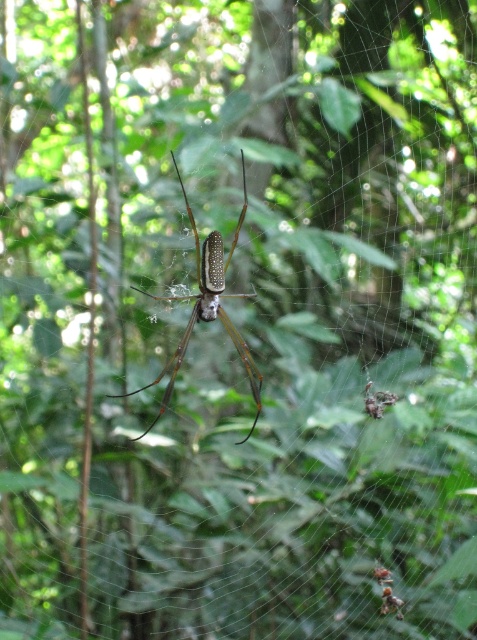
You are an entomologist observing two spiders in the forest. You see a shiny brown spider at center and a shiny metallic spider at center. Which spider has a greater width?

The shiny brown spider at center has a greater width than the shiny metallic spider at center according to the description.

You are an entomologist examining two spiders in the forest. You notice a shiny brown spider at center and a shiny metallic spider at center. Which spider is bigger?

The shiny brown spider at center is larger in size compared to the shiny metallic spider at center.